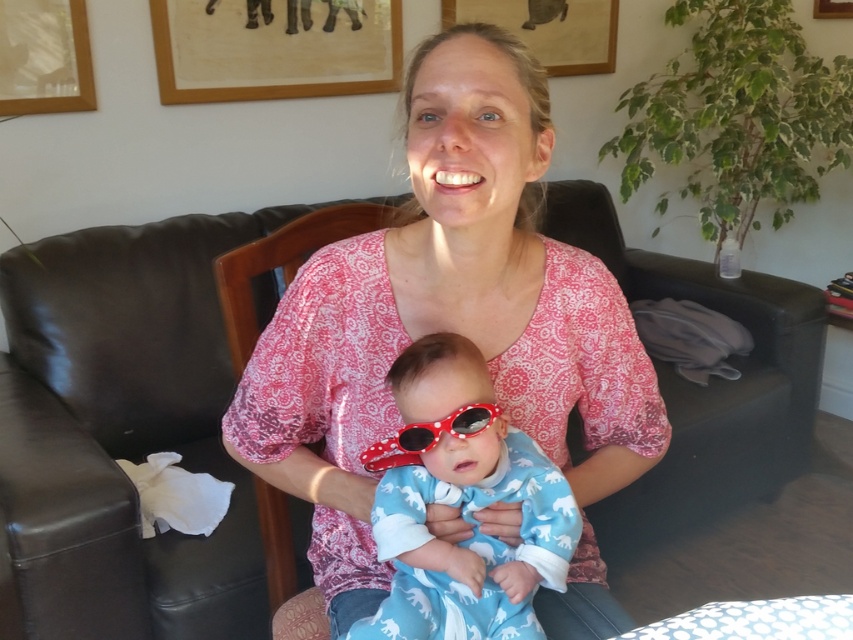
Question: In this image, where is black leather couch at center located relative to polka dot plastic goggles at center?

Choices:
 (A) below
 (B) above

Answer: (B)

Question: Estimate the real-world distances between objects in this image. Which object is closer to the pink printed blouse at center?

Choices:
 (A) black leather couch at center
 (B) blue cotton onesie at center

Answer: (B)

Question: Which of the following is the closest to the observer?

Choices:
 (A) (436, 573)
 (B) (370, 456)

Answer: (A)

Question: Does pink printed blouse at center appear on the right side of blue cotton onesie at center?

Choices:
 (A) no
 (B) yes

Answer: (B)

Question: Which of the following is the farthest from the observer?

Choices:
 (A) pink printed blouse at center
 (B) polka dot plastic goggles at center
 (C) black leather couch at center
 (D) blue cotton onesie at center

Answer: (C)

Question: Can you confirm if pink printed blouse at center is positioned above polka dot plastic goggles at center?

Choices:
 (A) yes
 (B) no

Answer: (A)